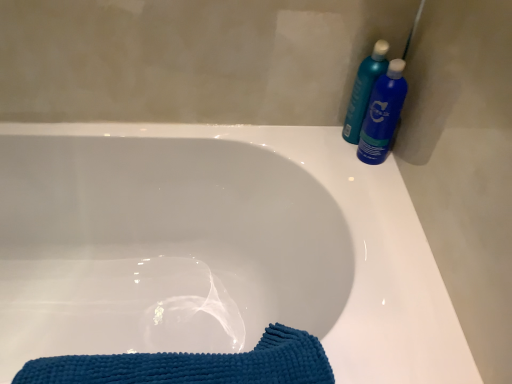
Find the location of a particular element. vacant space that is to the left of blue glossy bottle at upper right, which ranks as the 1th cleaning product in right-to-left order is located at coordinates (319, 138).